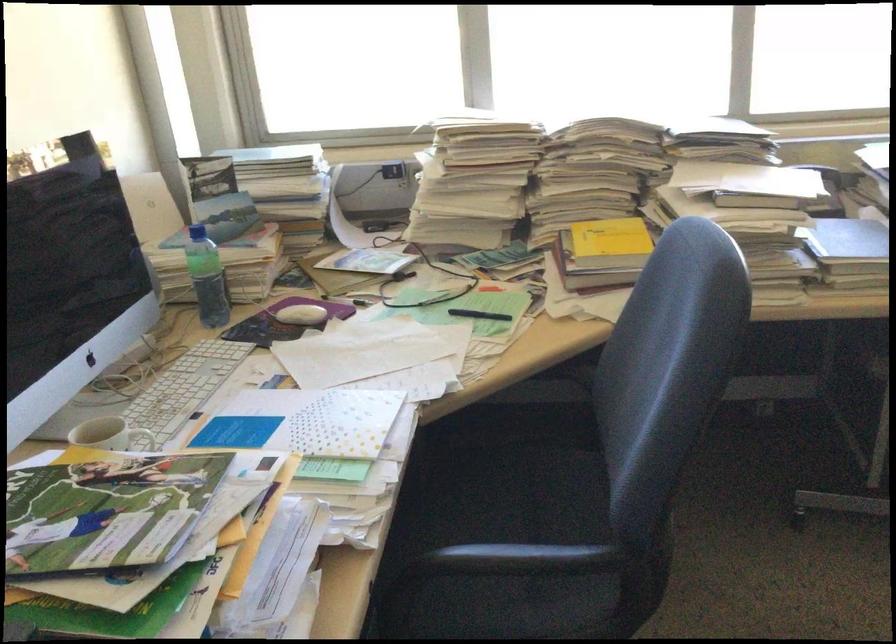
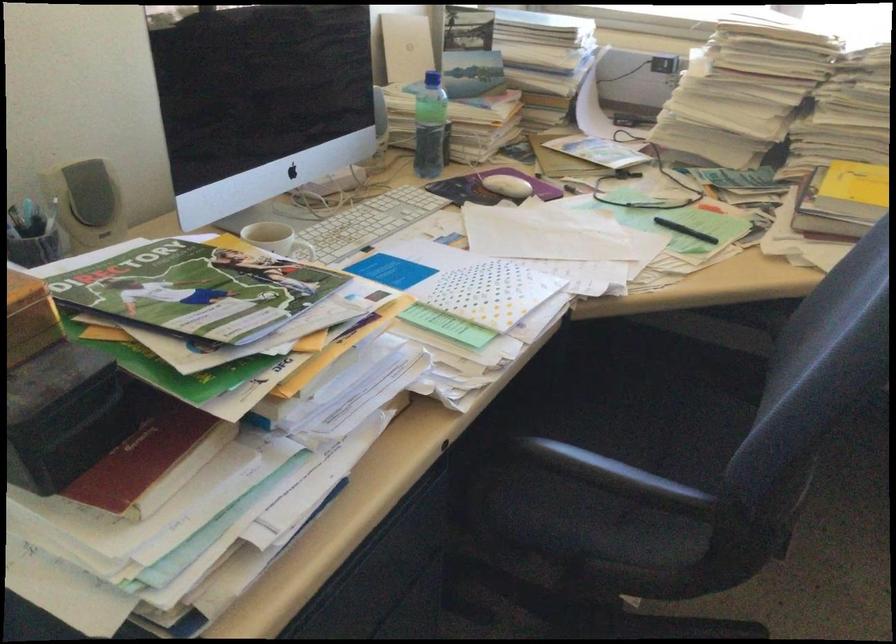
The point at (386, 270) is marked in the first image. Where is the corresponding point in the second image?

(610, 166)